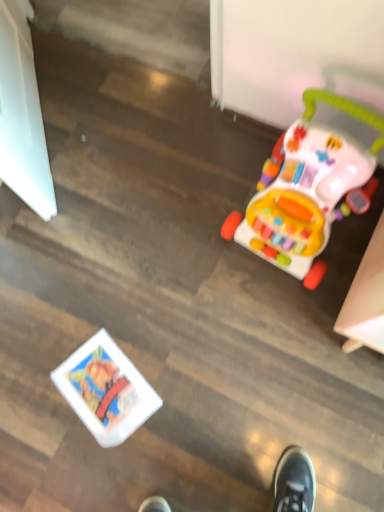
Question: Is white glossy book at lower left, the second toy from the top, spatially inside multicolored plastic walker at right, which appears as the 2th toy when ordered from the bottom, or outside of it?

Choices:
 (A) inside
 (B) outside

Answer: (B)

Question: In the image, is white glossy book at lower left, which is the 2th toy from right to left, positioned in front of or behind multicolored plastic walker at right, the first toy from the right?

Choices:
 (A) front
 (B) behind

Answer: (B)

Question: In terms of size, does white glossy book at lower left, arranged as the first toy when viewed from the left, appear bigger or smaller than multicolored plastic walker at right, which appears as the 2th toy when ordered from the bottom?

Choices:
 (A) small
 (B) big

Answer: (A)

Question: From a real-world perspective, is multicolored plastic walker at right, which appears as the 2th toy when ordered from the bottom, physically located above or below white glossy book at lower left, arranged as the first toy when viewed from the left?

Choices:
 (A) above
 (B) below

Answer: (A)

Question: Based on their sizes in the image, would you say multicolored plastic walker at right, positioned as the first toy in top-to-bottom order, is bigger or smaller than white glossy book at lower left, which is the 2th toy from right to left?

Choices:
 (A) small
 (B) big

Answer: (B)

Question: From the image's perspective, is multicolored plastic walker at right, the first toy from the right, above or below white glossy book at lower left, arranged as the first toy when viewed from the left?

Choices:
 (A) below
 (B) above

Answer: (B)

Question: Visually, is multicolored plastic walker at right, which appears as the 2th toy when ordered from the bottom, positioned to the left or to the right of white glossy book at lower left, the second toy from the top?

Choices:
 (A) right
 (B) left

Answer: (A)